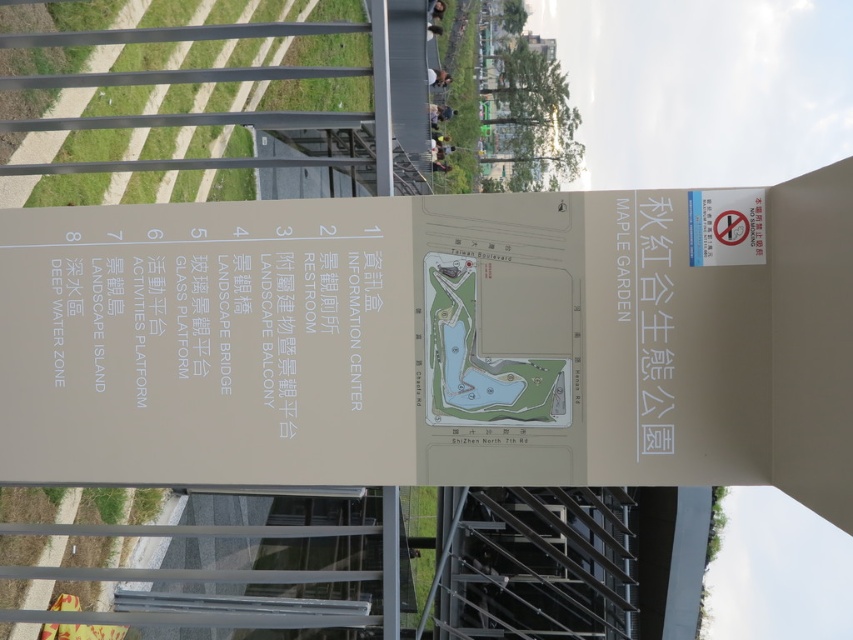
You are standing in front of the signboard and want to find the information center. Which direction should you look relative to the white matte sign at center to locate the white matte information center at upper center?

The white matte information center at upper center is behind the white matte sign at center, so you should look behind the white matte sign at center to find it.